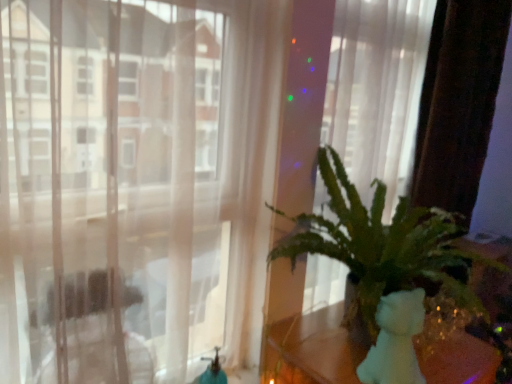
Locate an element on the screen. transparent curtain at center is located at coordinates (108, 190).

From the image's perspective, relative to white matte teddy bear at right, is green leafy plant at right above or below?

green leafy plant at right is situated higher than white matte teddy bear at right in the image.

Would you say white matte teddy bear at right is part of green leafy plant at right's contents?

Definitely not — white matte teddy bear at right is not inside green leafy plant at right.

From a real-world perspective, is green leafy plant at right physically below white matte teddy bear at right?

Incorrect, from a real-world perspective, green leafy plant at right is higher than white matte teddy bear at right.

Is green leafy plant at right behind white matte teddy bear at right?

No, green leafy plant at right is closer to the camera.

From the image's perspective, is white matte teddy bear at right over green leafy plant at right?

No, from the image's perspective, white matte teddy bear at right is not over green leafy plant at right.

Considering the relative sizes of white matte teddy bear at right and green leafy plant at right in the image provided, is white matte teddy bear at right bigger than green leafy plant at right?

No, white matte teddy bear at right is not bigger than green leafy plant at right.

Which object is positioned more to the right, white matte teddy bear at right or green leafy plant at right?

green leafy plant at right.

Consider the image. Does white matte teddy bear at right turn towards green leafy plant at right?

No, white matte teddy bear at right is not oriented towards green leafy plant at right.

Is green leafy plant at right not close to transparent curtain at center?

No.

Based on the photo, what's the angular difference between green leafy plant at right and transparent curtain at center's facing directions?

0.421 degrees.

From a real-world perspective, is green leafy plant at right on top of transparent curtain at center?

No, from a real-world perspective, green leafy plant at right is not on top of transparent curtain at center.

Which is correct: green leafy plant at right is inside transparent curtain at center, or outside of it?

green leafy plant at right is not inside transparent curtain at center, it's outside.

From the image's perspective, would you say white matte teddy bear at right is positioned over transparent curtain at center?

No.

Which is behind, white matte teddy bear at right or transparent curtain at center?

white matte teddy bear at right is more distant.

Locate an element on the screen. The width and height of the screenshot is (512, 384). window that is above the white matte teddy bear at right (from a real-world perspective) is located at coordinates (108, 190).

What's the angular difference between white matte teddy bear at right and transparent curtain at center's facing directions?

There is a 0.466-degree angle between the facing directions of white matte teddy bear at right and transparent curtain at center.

Is transparent curtain at center positioned far away from green leafy plant at right?

They are positioned close to each other.

Could you tell me if transparent curtain at center is turned towards green leafy plant at right?

No, transparent curtain at center is not turned towards green leafy plant at right.

Considering the relative sizes of transparent curtain at center and green leafy plant at right in the image provided, is transparent curtain at center bigger than green leafy plant at right?

No, transparent curtain at center is not bigger than green leafy plant at right.

How many degrees apart are the facing directions of transparent curtain at center and white matte teddy bear at right?

0.466 degrees separate the facing orientations of transparent curtain at center and white matte teddy bear at right.

Could you tell me if transparent curtain at center is facing white matte teddy bear at right?

No, transparent curtain at center is not oriented towards white matte teddy bear at right.

Locate an element on the screen. window above the white matte teddy bear at right (from the image's perspective) is located at coordinates (108, 190).

Which is more to the left, transparent curtain at center or white matte teddy bear at right?

Positioned to the left is transparent curtain at center.

This screenshot has width=512, height=384. What are the coordinates of `houseplant on the right of white matte teddy bear at right` in the screenshot? It's located at (382, 244).

Identify the location of houseplant that appears above the white matte teddy bear at right (from a real-world perspective). This screenshot has width=512, height=384. click(382, 244).

Based on their spatial positions, is green leafy plant at right or transparent curtain at center closer to white matte teddy bear at right?

green leafy plant at right.

In the scene shown: When comparing their distances from transparent curtain at center, does green leafy plant at right or white matte teddy bear at right seem closer?

green leafy plant at right is positioned closer to the anchor transparent curtain at center.

When comparing their distances from white matte teddy bear at right, does transparent curtain at center or green leafy plant at right seem closer?

Based on the image, green leafy plant at right appears to be nearer to white matte teddy bear at right.

Based on their spatial positions, is transparent curtain at center or white matte teddy bear at right closer to green leafy plant at right?

The object closer to green leafy plant at right is white matte teddy bear at right.

When comparing their distances from transparent curtain at center, does white matte teddy bear at right or green leafy plant at right seem closer?

green leafy plant at right is closer to transparent curtain at center.

Considering their positions, is white matte teddy bear at right positioned further to green leafy plant at right than transparent curtain at center?

Among the two, transparent curtain at center is located further to green leafy plant at right.

Image resolution: width=512 pixels, height=384 pixels. Find the location of `table between transparent curtain at center and green leafy plant at right`. table between transparent curtain at center and green leafy plant at right is located at coordinates (312, 349).